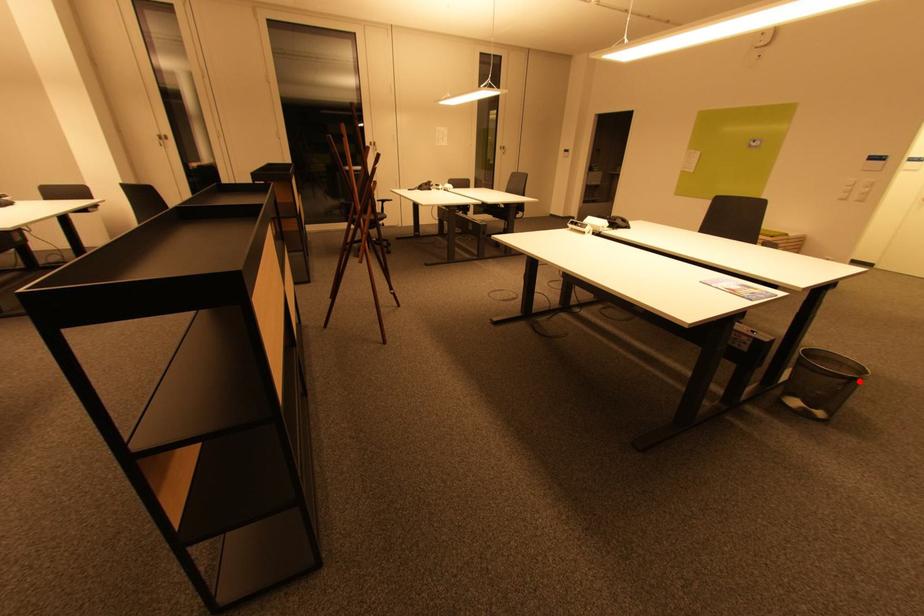
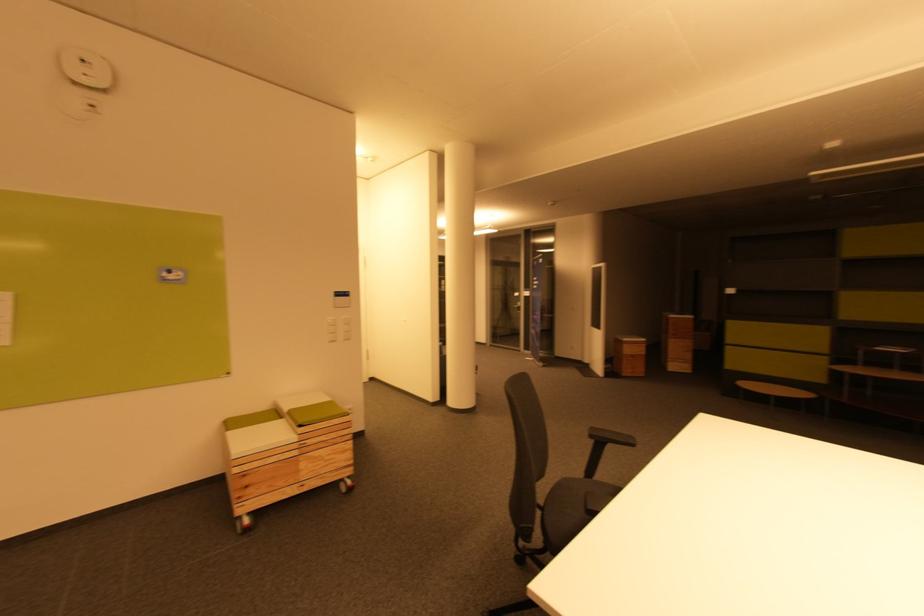
Question: I am providing you with two images of the same scene from different viewpoints. A red point is marked on the first image. Is the red point's position out of view in image 2?

Choices:
 (A) Yes
 (B) No

Answer: (A)